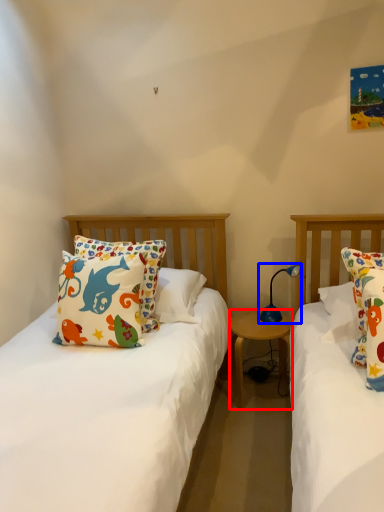
Question: Which object appears farthest to the camera in this image, nightstand (highlighted by a red box) or lamp (highlighted by a blue box)?

Choices:
 (A) nightstand
 (B) lamp

Answer: (A)